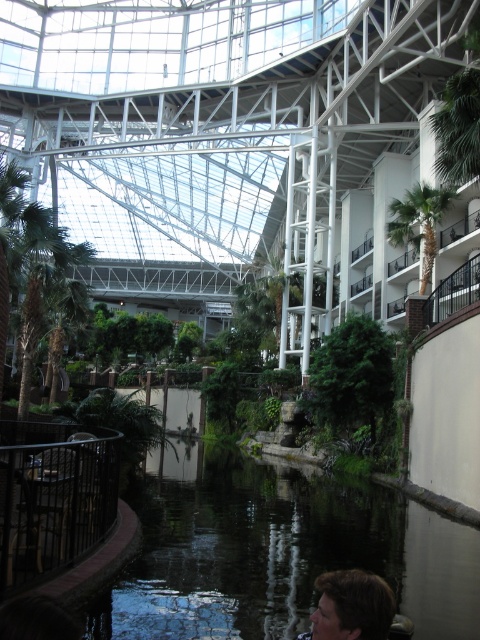
Question: Which point is farther to the camera?

Choices:
 (A) (416, 192)
 (B) (232, 460)

Answer: (A)

Question: Does smooth concrete pond at center appear under green leafy palm tree at upper right?

Choices:
 (A) no
 (B) yes

Answer: (B)

Question: Is the position of smooth concrete pond at center more distant than that of green leafy palm tree at upper right?

Choices:
 (A) no
 (B) yes

Answer: (A)

Question: Among these objects, which one is nearest to the camera?

Choices:
 (A) smooth concrete pond at center
 (B) green leafy palm tree at upper right

Answer: (A)

Question: Is smooth concrete pond at center smaller than green leafy palm tree at upper right?

Choices:
 (A) no
 (B) yes

Answer: (A)